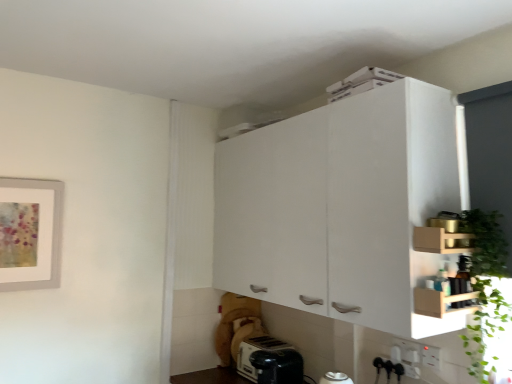
What do you see at coordinates (408, 351) in the screenshot? This screenshot has height=384, width=512. I see `white plastic electric outlet at lower right, which ranks as the 2th electric outlet in right-to-left order` at bounding box center [408, 351].

Describe the element at coordinates (343, 208) in the screenshot. The image size is (512, 384). I see `white matte cabinet at upper center, which is the 2th cabinetry in front-to-back order` at that location.

This screenshot has width=512, height=384. Describe the element at coordinates (430, 357) in the screenshot. I see `white plastic electric outlet at lower right, the second electric outlet positioned from the left` at that location.

How much space does white plastic electric outlet at lower right, the second electric outlet positioned from the left, occupy horizontally?

The width of white plastic electric outlet at lower right, the second electric outlet positioned from the left, is 0.72 inches.

This screenshot has height=384, width=512. Find the location of `green leafy plant at right`. green leafy plant at right is located at coordinates (485, 287).

Considering the positions of objects white plastic electric outlet at lower right, the second electric outlet positioned from the left, and white plastic electric outlet at lower right, which is the 2th electric outlet from front to back, in the image provided, who is more to the left, white plastic electric outlet at lower right, the second electric outlet positioned from the left, or white plastic electric outlet at lower right, which is the 2th electric outlet from front to back,?

white plastic electric outlet at lower right, which is the 2th electric outlet from front to back.

Which object is wider, white plastic electric outlet at lower right, positioned as the second electric outlet in back-to-front order, or white plastic electric outlet at lower right, which is the 2th electric outlet from front to back?

With larger width is white plastic electric outlet at lower right, positioned as the second electric outlet in back-to-front order.

Is white plastic electric outlet at lower right, placed as the 1th electric outlet when sorted from right to left, facing towards white plastic electric outlet at lower right, acting as the 1th electric outlet starting from the left?

No, white plastic electric outlet at lower right, placed as the 1th electric outlet when sorted from right to left, is not turned towards white plastic electric outlet at lower right, acting as the 1th electric outlet starting from the left.

From the image's perspective, which is below, white plastic electric outlet at lower right, the second electric outlet positioned from the left, or white plastic electric outlet at lower right, which appears as the 1th electric outlet when viewed from the back?

white plastic electric outlet at lower right, which appears as the 1th electric outlet when viewed from the back, from the image's perspective.

From a real-world perspective, which is physically below, white plastic electric outlet at lower right, the second electric outlet positioned from the left, or white plastic toaster at lower center?

white plastic toaster at lower center, from a real-world perspective.

Considering the relative sizes of white plastic electric outlet at lower right, the 1th electric outlet in the front-to-back sequence, and white plastic toaster at lower center in the image provided, is white plastic electric outlet at lower right, the 1th electric outlet in the front-to-back sequence, taller than white plastic toaster at lower center?

Incorrect, the height of white plastic electric outlet at lower right, the 1th electric outlet in the front-to-back sequence, is not larger of that of white plastic toaster at lower center.

Can white plastic toaster at lower center be found inside white plastic electric outlet at lower right, the second electric outlet positioned from the left?

No, white plastic electric outlet at lower right, the second electric outlet positioned from the left, does not contain white plastic toaster at lower center.

Find the location of `electric outlet that is the 2nd one when counting upward from the white plastic toaster at lower center (from the image's perspective)`. electric outlet that is the 2nd one when counting upward from the white plastic toaster at lower center (from the image's perspective) is located at coordinates (430, 357).

Which object is thinner, white matte cabinet at upper center, the first cabinetry positioned from the back, or green leafy plant at right?

Thinner between the two is green leafy plant at right.

Considering the sizes of objects white matte cabinet at upper center, which is the 2th cabinetry in front-to-back order, and green leafy plant at right in the image provided, who is shorter, white matte cabinet at upper center, which is the 2th cabinetry in front-to-back order, or green leafy plant at right?

A: With less height is green leafy plant at right.

Could you tell me if white matte cabinet at upper center, which is the 2th cabinetry in front-to-back order, is facing green leafy plant at right?

No.

From a real-world perspective, is wooden shelf at upper right, which is the 2th cabinetry from back to front, under white plastic toaster at lower center?

No, from a real-world perspective, wooden shelf at upper right, which is the 2th cabinetry from back to front, is not beneath white plastic toaster at lower center.

Is wooden shelf at upper right, arranged as the 1th cabinetry when viewed from the front, directly adjacent to white plastic toaster at lower center?

No, wooden shelf at upper right, arranged as the 1th cabinetry when viewed from the front, is not making contact with white plastic toaster at lower center.

How different are the orientations of wooden shelf at upper right, arranged as the 1th cabinetry when viewed from the front, and white plastic toaster at lower center in degrees?

90 degrees separate the facing orientations of wooden shelf at upper right, arranged as the 1th cabinetry when viewed from the front, and white plastic toaster at lower center.

From the image's perspective, starting from the white plastic toaster at lower center, which cabinetry is the 1st one above? Please provide its 2D coordinates.

[(438, 240)]

Can you confirm if white plastic toaster at lower center is positioned to the right of white plastic electric outlet at lower right, the 1th electric outlet in the front-to-back sequence?

No, white plastic toaster at lower center is not to the right of white plastic electric outlet at lower right, the 1th electric outlet in the front-to-back sequence.

Considering the sizes of white plastic toaster at lower center and white plastic electric outlet at lower right, the 1th electric outlet in the front-to-back sequence, in the image, is white plastic toaster at lower center bigger or smaller than white plastic electric outlet at lower right, the 1th electric outlet in the front-to-back sequence,?

In the image, white plastic toaster at lower center appears to be larger than white plastic electric outlet at lower right, the 1th electric outlet in the front-to-back sequence.

What are the coordinates of `appliance behind the white plastic electric outlet at lower right, the 1th electric outlet in the front-to-back sequence` in the screenshot? It's located at (x=253, y=351).

Looking at this image, from the image's perspective, between white plastic toaster at lower center and white plastic electric outlet at lower right, the second electric outlet positioned from the left, who is located below?

white plastic toaster at lower center.

Considering the relative sizes of green leafy plant at right and wooden shelf at upper right, which is the 2th cabinetry from back to front, in the image provided, is green leafy plant at right thinner than wooden shelf at upper right, which is the 2th cabinetry from back to front,?

Incorrect, the width of green leafy plant at right is not less than that of wooden shelf at upper right, which is the 2th cabinetry from back to front.

From the image's perspective, is green leafy plant at right above wooden shelf at upper right, which is the 2th cabinetry from back to front?

Incorrect, from the image's perspective, green leafy plant at right is lower than wooden shelf at upper right, which is the 2th cabinetry from back to front.

Is green leafy plant at right located outside wooden shelf at upper right, which is the 2th cabinetry from back to front?

green leafy plant at right lies outside wooden shelf at upper right, which is the 2th cabinetry from back to front,'s area.

How different are the orientations of white plastic toaster at lower center and white plastic electric outlet at lower right, which appears as the 1th electric outlet when viewed from the back, in degrees?

The angle between the facing direction of white plastic toaster at lower center and the facing direction of white plastic electric outlet at lower right, which appears as the 1th electric outlet when viewed from the back, is 0.000294 degrees.

From the image's perspective, is white plastic toaster at lower center under white plastic electric outlet at lower right, acting as the 1th electric outlet starting from the left?

Correct, white plastic toaster at lower center appears lower than white plastic electric outlet at lower right, acting as the 1th electric outlet starting from the left, in the image.

Could you tell me if white plastic toaster at lower center is facing white plastic electric outlet at lower right, which is the 2th electric outlet from front to back?

No, white plastic toaster at lower center is not turned towards white plastic electric outlet at lower right, which is the 2th electric outlet from front to back.

Identify the location of electric outlet behind the white plastic electric outlet at lower right, the 1th electric outlet in the front-to-back sequence. This screenshot has height=384, width=512. (408, 351).

In order to click on the 1st electric outlet above the white plastic toaster at lower center (from a real-world perspective) in this screenshot , I will do `click(430, 357)`.

Based on their spatial positions, is white plastic electric outlet at lower right, positioned as the second electric outlet in back-to-front order, or white plastic electric outlet at lower right, which ranks as the 2th electric outlet in right-to-left order, closer to white plastic toaster at lower center?

Among the two, white plastic electric outlet at lower right, which ranks as the 2th electric outlet in right-to-left order, is located nearer to white plastic toaster at lower center.

Looking at the image, which one is located further to white plastic electric outlet at lower right, placed as the 1th electric outlet when sorted from right to left, green leafy plant at right or white plastic toaster at lower center?

white plastic toaster at lower center is further to white plastic electric outlet at lower right, placed as the 1th electric outlet when sorted from right to left.

From the picture: Based on their spatial positions, is white plastic electric outlet at lower right, which is the 2th electric outlet from front to back, or wooden shelf at upper right, which is the 2th cabinetry from back to front, closer to green leafy plant at right?

wooden shelf at upper right, which is the 2th cabinetry from back to front, is positioned closer to the anchor green leafy plant at right.

Considering their positions, is white matte cabinet at upper center, which is the 2th cabinetry in front-to-back order, positioned closer to wooden shelf at upper right, arranged as the 1th cabinetry when viewed from the front, than green leafy plant at right?

The object closer to wooden shelf at upper right, arranged as the 1th cabinetry when viewed from the front, is green leafy plant at right.

Based on the photo, based on their spatial positions, is white plastic electric outlet at lower right, positioned as the second electric outlet in back-to-front order, or white plastic toaster at lower center further from white matte cabinet at upper center, which is the 2th cabinetry in front-to-back order?

white plastic toaster at lower center is positioned further to the anchor white matte cabinet at upper center, which is the 2th cabinetry in front-to-back order.

Looking at this image, considering their positions, is white plastic toaster at lower center positioned closer to green leafy plant at right than wooden shelf at upper right, which is the 2th cabinetry from back to front?

Among the two, wooden shelf at upper right, which is the 2th cabinetry from back to front, is located nearer to green leafy plant at right.

Estimate the real-world distances between objects in this image. Which object is further from white plastic electric outlet at lower right, placed as the 1th electric outlet when sorted from right to left, white matte cabinet at upper center, which is the 2th cabinetry in front-to-back order, or white plastic toaster at lower center?

white plastic toaster at lower center.

Which object lies further to the anchor point white plastic electric outlet at lower right, which appears as the 1th electric outlet when viewed from the back, wooden shelf at upper right, arranged as the 1th cabinetry when viewed from the front, or white matte cabinet at upper center, the first cabinetry positioned from the back?

Based on the image, white matte cabinet at upper center, the first cabinetry positioned from the back, appears to be further to white plastic electric outlet at lower right, which appears as the 1th electric outlet when viewed from the back.

Where is `cabinetry between white matte cabinet at upper center, the first cabinetry positioned from the back, and white plastic electric outlet at lower right, which is the 2th electric outlet from front to back, in the vertical direction`? The width and height of the screenshot is (512, 384). cabinetry between white matte cabinet at upper center, the first cabinetry positioned from the back, and white plastic electric outlet at lower right, which is the 2th electric outlet from front to back, in the vertical direction is located at coordinates (x=438, y=240).

I want to click on cabinetry positioned between wooden shelf at upper right, arranged as the 1th cabinetry when viewed from the front, and white plastic toaster at lower center from near to far, so click(x=343, y=208).

Locate an element on the screen. The image size is (512, 384). plant between white matte cabinet at upper center, which is the 2th cabinetry in front-to-back order, and white plastic electric outlet at lower right, which ranks as the 2th electric outlet in right-to-left order, in the up-down direction is located at coordinates (485, 287).

The width and height of the screenshot is (512, 384). What are the coordinates of `plant between wooden shelf at upper right, arranged as the 1th cabinetry when viewed from the front, and white plastic electric outlet at lower right, positioned as the second electric outlet in back-to-front order, in the vertical direction` in the screenshot? It's located at (485, 287).